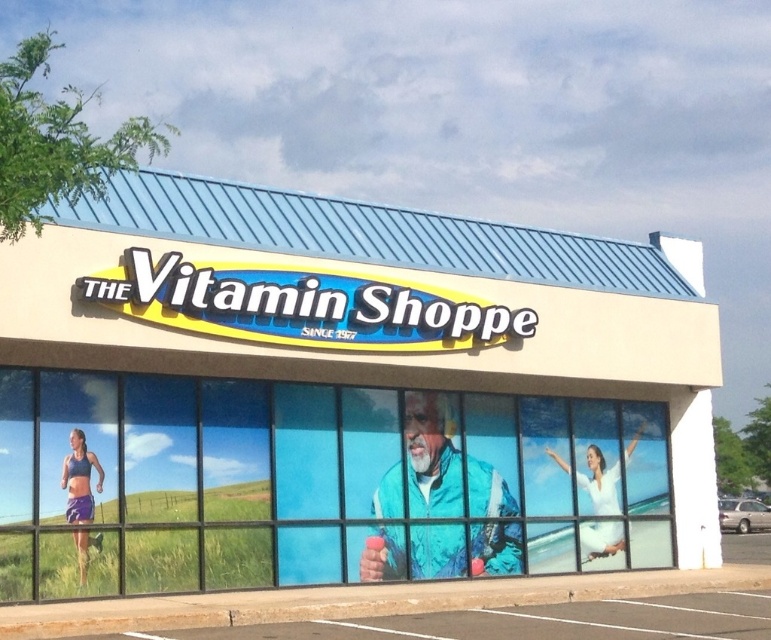
Question: Is white sign at center behind silver metallic car at lower right?

Choices:
 (A) no
 (B) yes

Answer: (A)

Question: Can you confirm if white sign at center is positioned below silver metallic car at lower right?

Choices:
 (A) yes
 (B) no

Answer: (B)

Question: Considering the relative positions of white sign at center and silver metallic car at lower right in the image provided, where is white sign at center located with respect to silver metallic car at lower right?

Choices:
 (A) above
 (B) below

Answer: (A)

Question: Which of the following is the closest to the observer?

Choices:
 (A) white sign at center
 (B) silver metallic car at lower right

Answer: (A)

Question: Which object is closer to the camera taking this photo?

Choices:
 (A) white sign at center
 (B) silver metallic car at lower right

Answer: (A)